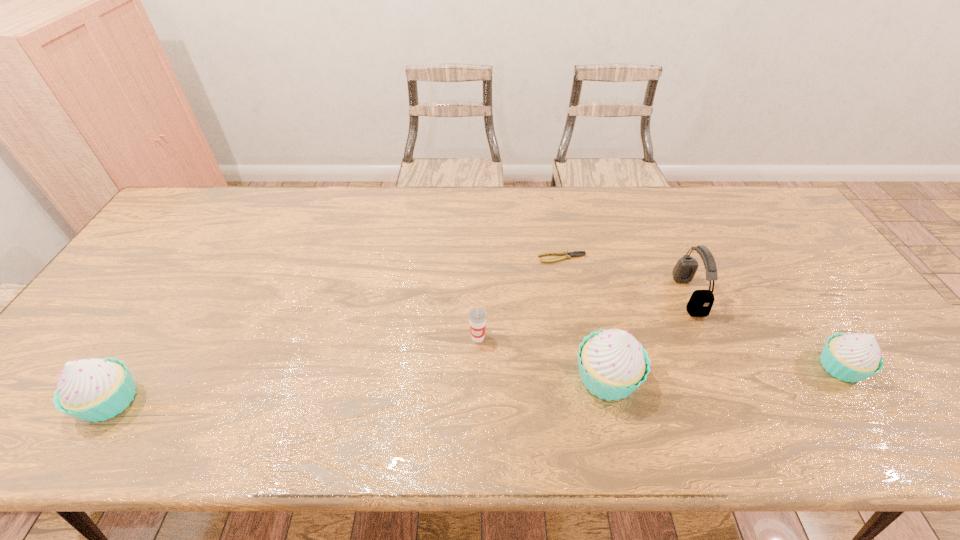
Where is `object that is at the right edge`? The height and width of the screenshot is (540, 960). object that is at the right edge is located at coordinates (853, 357).

Image resolution: width=960 pixels, height=540 pixels. I want to click on object present at the near left corner, so click(92, 389).

I want to click on object located in the near right corner section of the desktop, so coord(853,357).

Find the location of `free space at the far edge`. free space at the far edge is located at coordinates (692, 222).

Locate an element on the screen. The image size is (960, 540). free space at the near edge is located at coordinates [x=784, y=401].

The width and height of the screenshot is (960, 540). Find the location of `free space at the left edge of the desktop`. free space at the left edge of the desktop is located at coordinates (204, 239).

In the image, there is a desktop. At what (x,y) coordinates should I click in order to perform the action: click on vacant area at the far right corner. Please return your answer as a coordinate pair (x, y). Looking at the image, I should click on (756, 200).

Locate an element on the screen. Image resolution: width=960 pixels, height=540 pixels. vacant space in between the second cupcake from right to left and the shortest object is located at coordinates (585, 318).

What are the coordinates of `free space between the rightmost cupcake and the cup` in the screenshot? It's located at (660, 352).

This screenshot has width=960, height=540. I want to click on empty space between the fifth object from right to left and the leftmost object, so click(294, 369).